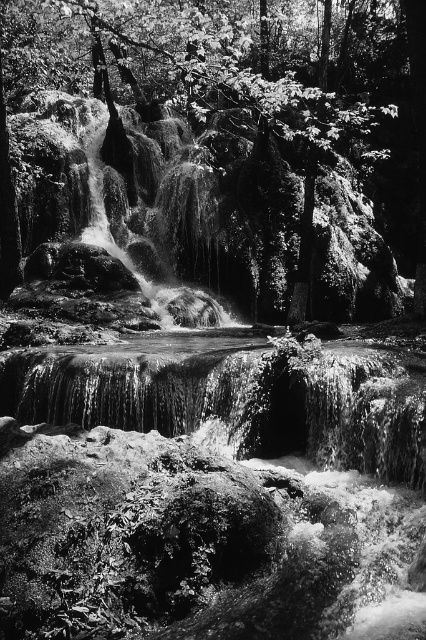
Question: Among these points, which one is nearest to the camera?

Choices:
 (A) (287, 548)
 (B) (34, 236)

Answer: (A)

Question: Which object is closer to the camera taking this photo?

Choices:
 (A) translucent water at center
 (B) smooth bark tree at upper center

Answer: (A)

Question: Is translucent water at center to the right of smooth bark tree at upper center from the viewer's perspective?

Choices:
 (A) no
 (B) yes

Answer: (A)

Question: Which object is farther from the camera taking this photo?

Choices:
 (A) translucent water at center
 (B) smooth bark tree at upper center

Answer: (B)

Question: Is translucent water at center above smooth bark tree at upper center?

Choices:
 (A) no
 (B) yes

Answer: (A)

Question: Can you confirm if translucent water at center is positioned below smooth bark tree at upper center?

Choices:
 (A) no
 (B) yes

Answer: (B)